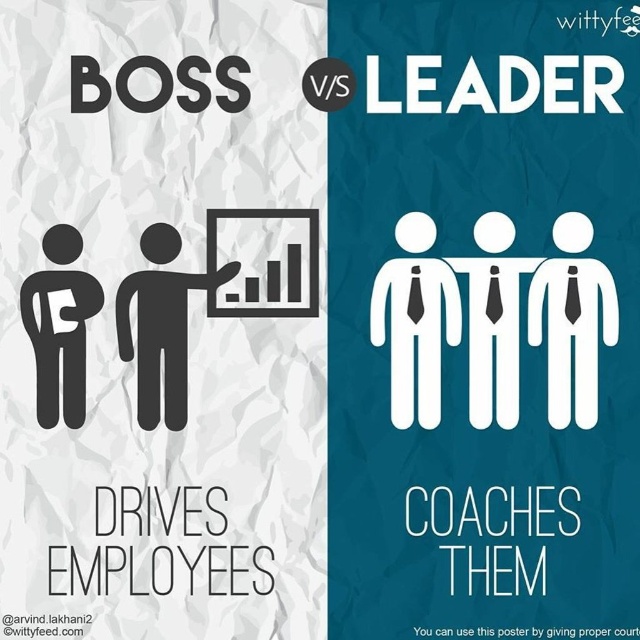
You are analyzing the infographic comparing BOSS and LEADER. There are two points marked in the image. Point A is at coordinates point (152,388) and Point B is at point (54,358). Which point is closer to the camera?

Point A at point (152,388) is further to the camera than point B at point (54,358), so Point B is closer to the camera.